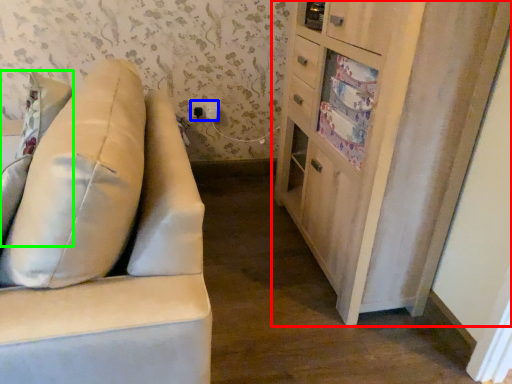
Question: Considering the real-world distances, which object is farthest from cabinetry (highlighted by a red box)? electric outlet (highlighted by a blue box) or pillow (highlighted by a green box)?

Choices:
 (A) electric outlet
 (B) pillow

Answer: (A)